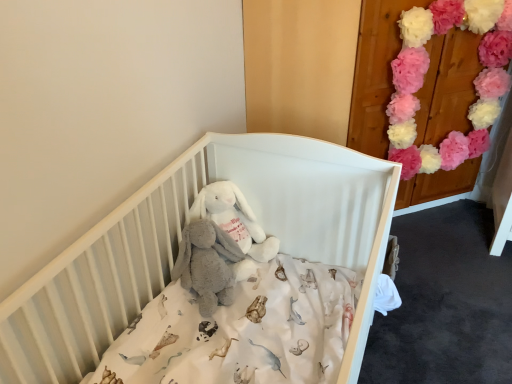
Question: Does white matte crib at center have a lesser width compared to pink fluffy pom-poms at upper right?

Choices:
 (A) yes
 (B) no

Answer: (B)

Question: Does white matte crib at center have a smaller size compared to pink fluffy pom-poms at upper right?

Choices:
 (A) no
 (B) yes

Answer: (A)

Question: Is white matte crib at center not inside pink fluffy pom-poms at upper right?

Choices:
 (A) yes
 (B) no

Answer: (A)

Question: Could you tell me if white matte crib at center is facing pink fluffy pom-poms at upper right?

Choices:
 (A) no
 (B) yes

Answer: (A)

Question: Can you confirm if white matte crib at center is positioned to the right of pink fluffy pom-poms at upper right?

Choices:
 (A) no
 (B) yes

Answer: (A)

Question: From the image's perspective, is white matte crib at center below pink fluffy pom-poms at upper right?

Choices:
 (A) no
 (B) yes

Answer: (B)

Question: From the image's perspective, is white plush rabbit at center above pink fluffy pom-poms at upper right?

Choices:
 (A) no
 (B) yes

Answer: (A)

Question: From the image's perspective, is white plush rabbit at center beneath pink fluffy pom-poms at upper right?

Choices:
 (A) no
 (B) yes

Answer: (B)

Question: Is white plush rabbit at center at the left side of pink fluffy pom-poms at upper right?

Choices:
 (A) no
 (B) yes

Answer: (B)

Question: Is white plush rabbit at center wider than pink fluffy pom-poms at upper right?

Choices:
 (A) no
 (B) yes

Answer: (B)

Question: Would you consider white plush rabbit at center to be distant from pink fluffy pom-poms at upper right?

Choices:
 (A) yes
 (B) no

Answer: (A)

Question: Can you confirm if white plush rabbit at center is positioned to the right of pink fluffy pom-poms at upper right?

Choices:
 (A) no
 (B) yes

Answer: (A)

Question: From the image's perspective, is pink fluffy pom-poms at upper right above white plush rabbit at center?

Choices:
 (A) yes
 (B) no

Answer: (A)